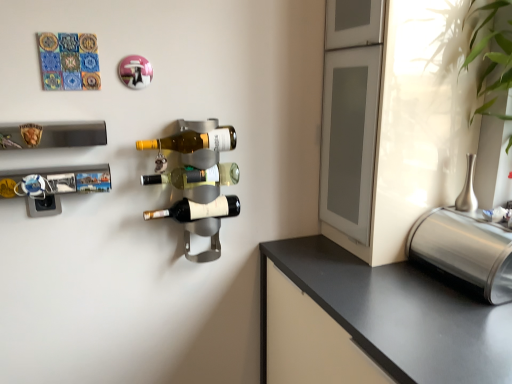
Question: From the image's perspective, is metallic silver wine rack at left, the 2th wine rack when ordered from top to bottom, located above or below shiny metallic wine bottle at center, the 1th beer bottle from the bottom?

Choices:
 (A) above
 (B) below

Answer: (A)

Question: From a real-world perspective, is metallic silver wine rack at left, which appears as the 1th wine rack when ordered from the bottom, positioned above or below shiny metallic wine bottle at center, the 1th beer bottle from the bottom?

Choices:
 (A) below
 (B) above

Answer: (B)

Question: Which object is positioned farthest from the matte glass beer bottle at center, which is the 1th beer bottle in top-to-bottom order?

Choices:
 (A) shiny metallic wine bottle at center, which ranks as the third beer bottle in top-to-bottom order
 (B) translucent glass bottle at center, which is the second beer bottle from top to bottom
 (C) metallic cylindrical container at right
 (D) green leafy plant at upper right
 (E) metallic silver wine rack at left, which appears as the 1th wine rack when ordered from the bottom

Answer: (D)

Question: Considering the real-world distances, which object is farthest from the black plastic wine rack at upper left, the 1th wine rack viewed from the top?

Choices:
 (A) metallic cylindrical container at right
 (B) green leafy plant at upper right
 (C) metallic silver wine rack at left, which appears as the 1th wine rack when ordered from the bottom
 (D) translucent glass bottle at center, which is the second beer bottle from top to bottom
 (E) shiny metallic wine bottle at center, the 1th beer bottle from the bottom

Answer: (B)